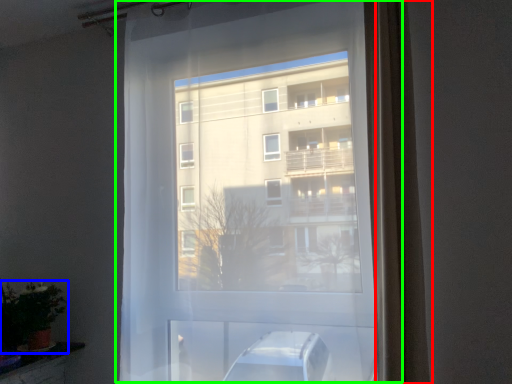
Question: Estimate the real-world distances between objects in this image. Which object is farther from curtain (highlighted by a red box), houseplant (highlighted by a blue box) or window (highlighted by a green box)?

Choices:
 (A) houseplant
 (B) window

Answer: (A)